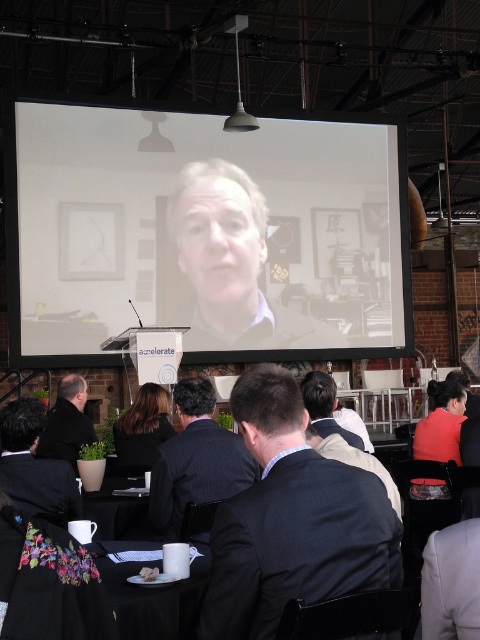
Is black suit at lower left positioned in front of dark suit at lower left?

Yes, it is in front of dark suit at lower left.

Is black suit at lower left bigger than dark suit at lower left?

No, black suit at lower left is not bigger than dark suit at lower left.

The width and height of the screenshot is (480, 640). In order to click on black suit at lower left in this screenshot , I will do `click(35, 467)`.

I want to click on black suit at lower left, so click(x=35, y=467).

Does point (216, 266) come behind point (91, 497)?

Yes, point (216, 266) is behind point (91, 497).

Does matte skin face at upper center appear on the right side of black plastic table at lower center?

Correct, you'll find matte skin face at upper center to the right of black plastic table at lower center.

Is point (215, 307) positioned before point (128, 477)?

No, it is not.

The width and height of the screenshot is (480, 640). I want to click on matte skin face at upper center, so click(218, 244).

Can you confirm if matte brown suit at center is wider than smooth skin face at center?

Indeed, matte brown suit at center has a greater width compared to smooth skin face at center.

How much distance is there between matte brown suit at center and smooth skin face at center?

matte brown suit at center is 5.49 meters away from smooth skin face at center.

The height and width of the screenshot is (640, 480). Describe the element at coordinates (231, 264) in the screenshot. I see `matte brown suit at center` at that location.

The height and width of the screenshot is (640, 480). I want to click on matte brown suit at center, so click(x=231, y=264).